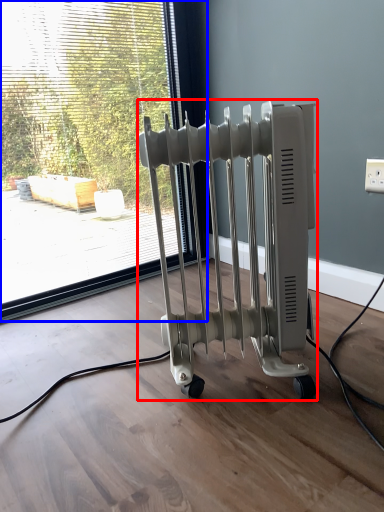
Question: Which object is closer to the camera taking this photo, bath heater (highlighted by a red box) or window (highlighted by a blue box)?

Choices:
 (A) bath heater
 (B) window

Answer: (A)